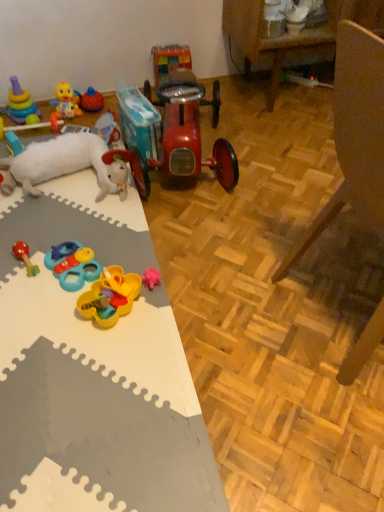
Identify the location of vacant space behind rubberized red and green rattle at lower left, which is the 4th toy from left to right. The width and height of the screenshot is (384, 512). (42, 229).